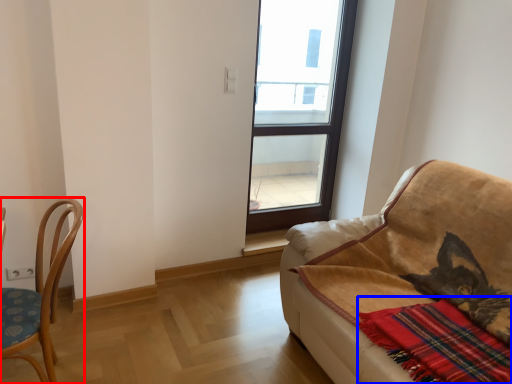
Question: Among these objects, which one is nearest to the camera, chair (highlighted by a red box) or plaid (highlighted by a blue box)?

Choices:
 (A) chair
 (B) plaid

Answer: (B)